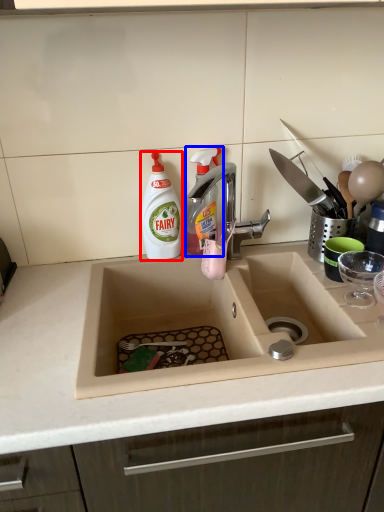
Question: Which of the following is the closest to the observer, cleaning product (highlighted by a red box) or cleaning product (highlighted by a blue box)?

Choices:
 (A) cleaning product
 (B) cleaning product

Answer: (A)